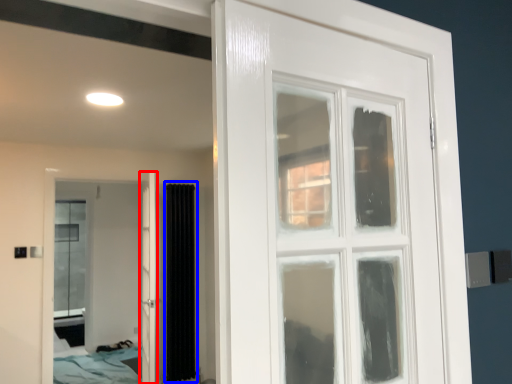
Question: Which point is closer to the camera, door (highlighted by a red box) or curtain (highlighted by a blue box)?

Choices:
 (A) door
 (B) curtain

Answer: (A)